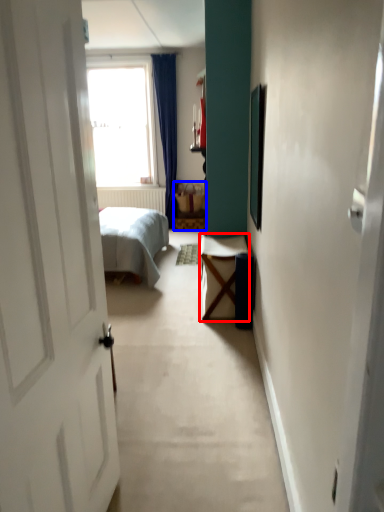
Question: Which object is further to the camera taking this photo, table (highlighted by a red box) or furniture (highlighted by a blue box)?

Choices:
 (A) table
 (B) furniture

Answer: (B)